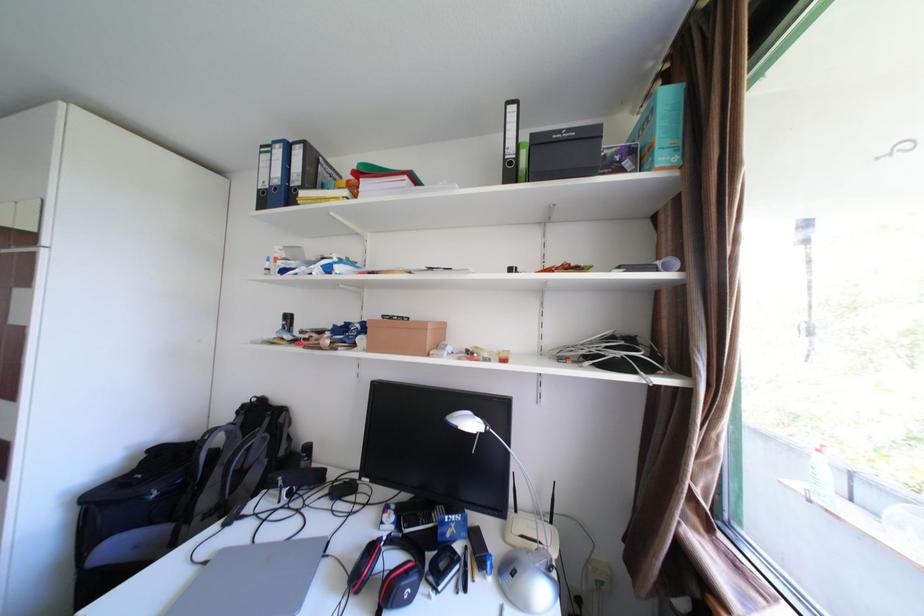
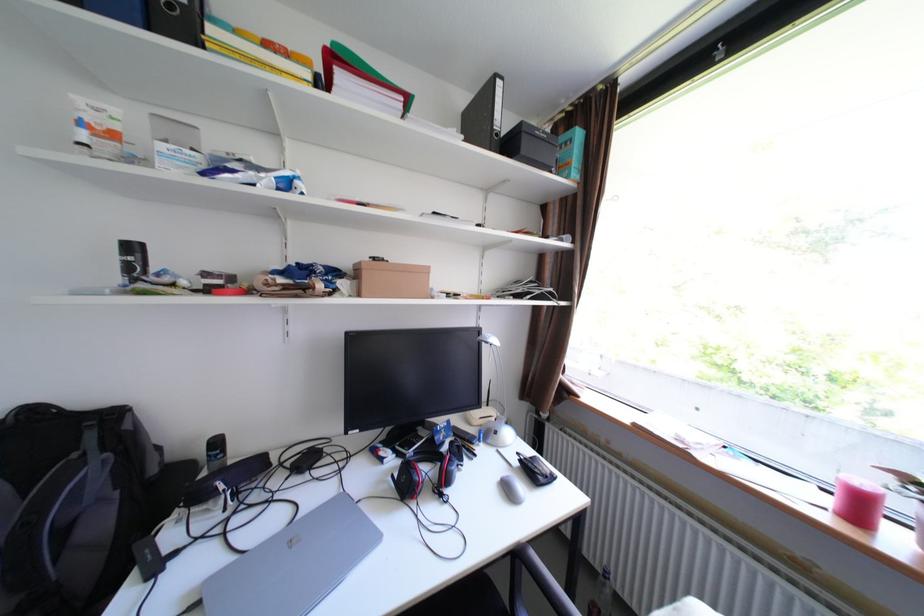
Question: The camera is either moving clockwise (left) or counter-clockwise (right) around the object. The first image is from the beginning of the video and the second image is from the end. Is the camera moving left or right when shooting the video?

Choices:
 (A) Left
 (B) Right

Answer: (A)